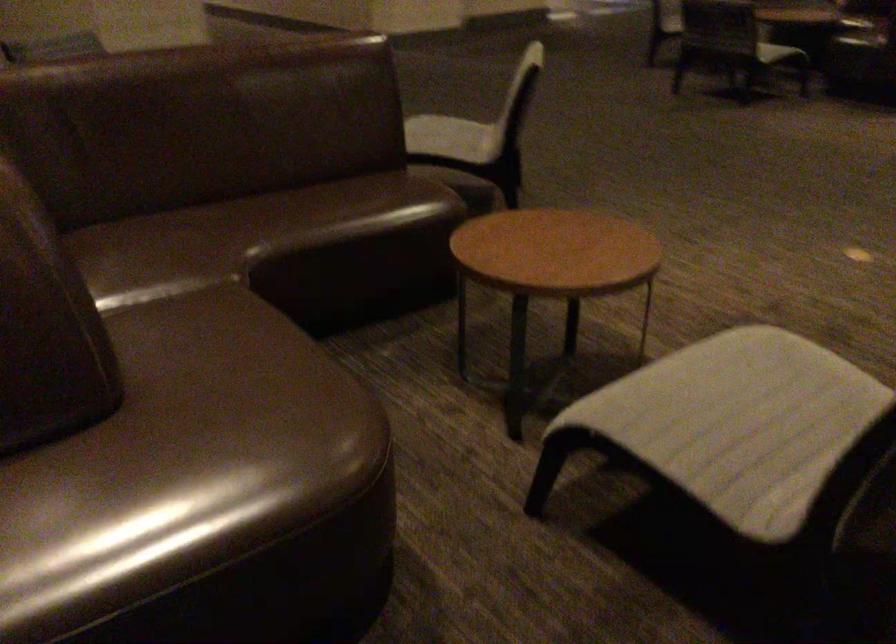
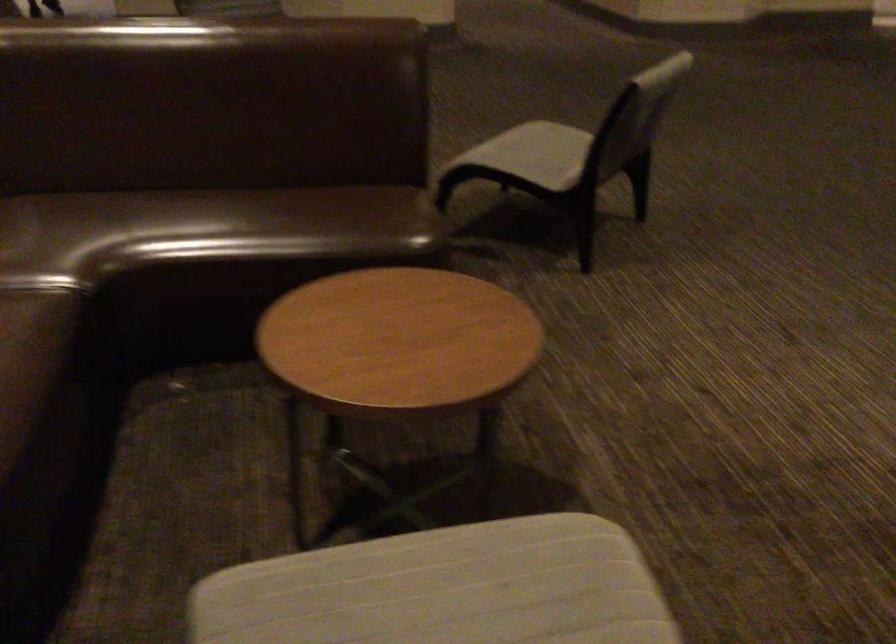
The point at (714, 381) is marked in the first image. Where is the corresponding point in the second image?

(444, 589)